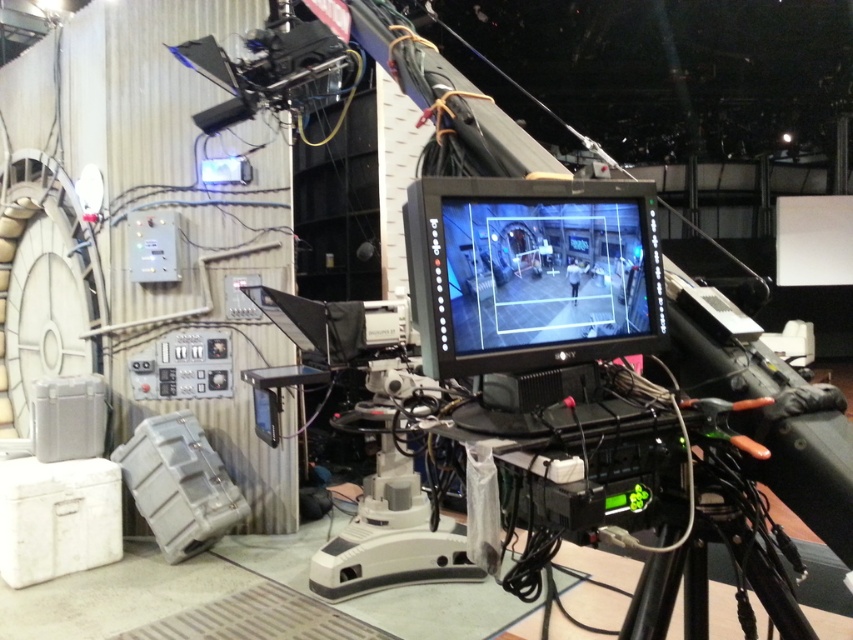
Between point (659, 340) and point (689, 582), which one is positioned behind?

Positioned behind is point (689, 582).

Does matte black monitor at center appear on the right side of black plastic tripod at lower right?

No, matte black monitor at center is not to the right of black plastic tripod at lower right.

This screenshot has height=640, width=853. Find the location of `matte black monitor at center`. matte black monitor at center is located at coordinates (531, 273).